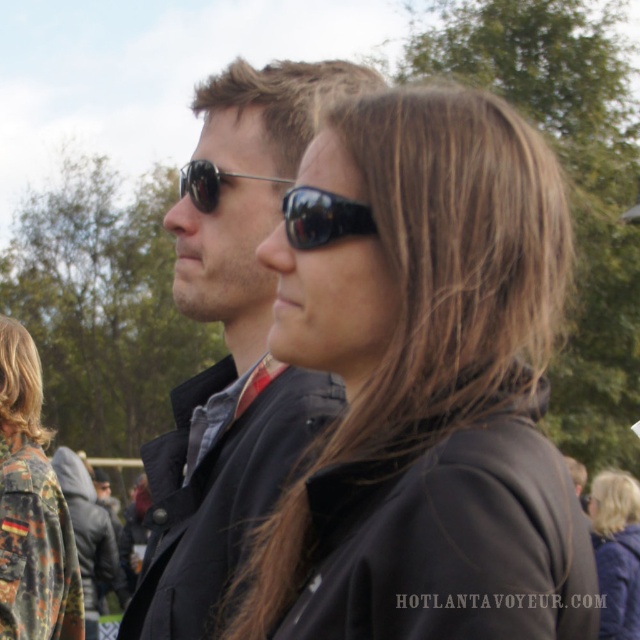
Is matte black sunglasses at center above matte black jacket at center?

Correct, matte black sunglasses at center is located above matte black jacket at center.

Can you confirm if matte black sunglasses at center is positioned to the left of matte black jacket at center?

Incorrect, matte black sunglasses at center is not on the left side of matte black jacket at center.

Measure the distance between point [406,196] and camera.

They are 3.71 meters apart.

Find the location of a particular element. matte black sunglasses at center is located at coordinates (428, 387).

Which is below, matte black sunglasses at center or black reflective sunglasses at center?

Positioned lower is matte black sunglasses at center.

Which is behind, point (291, 612) or point (344, 234)?

The point (344, 234) is behind.

Is point (340, 595) positioned after point (292, 211)?

That is False.

You are a GUI agent. You are given a task and a screenshot of the screen. Output one action in this format:
    pyautogui.click(x=<x>, y=<y>)
    Task: Click on the matte black sunglasses at center
    Image resolution: width=640 pixels, height=640 pixels.
    Given the screenshot: What is the action you would take?
    pyautogui.click(x=428, y=387)

Who is shorter, camouflage jacket at lower left or black reflective sunglasses at center?

black reflective sunglasses at center

Does camouflage jacket at lower left have a lesser height compared to black reflective sunglasses at center?

Incorrect, camouflage jacket at lower left's height does not fall short of black reflective sunglasses at center's.

The image size is (640, 640). I want to click on camouflage jacket at lower left, so click(32, 508).